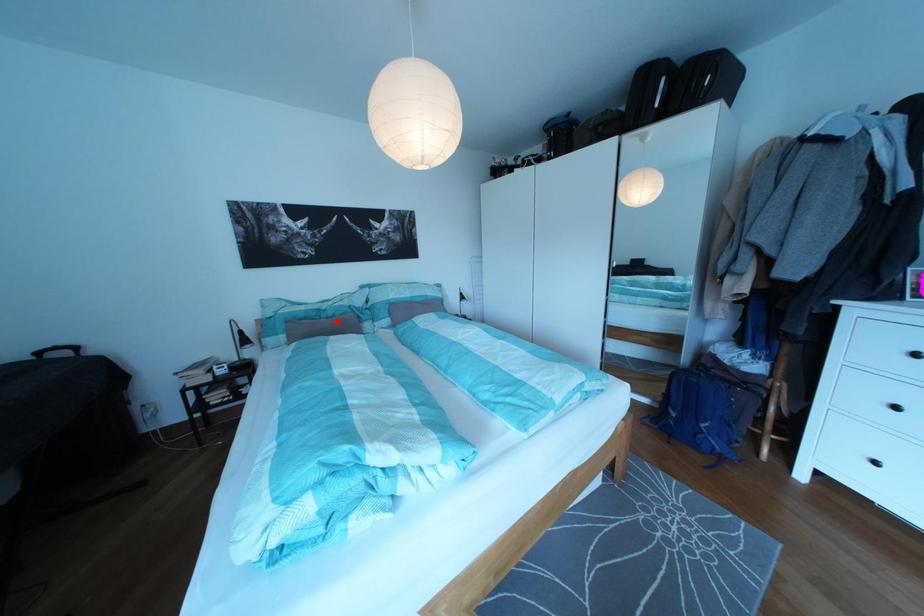
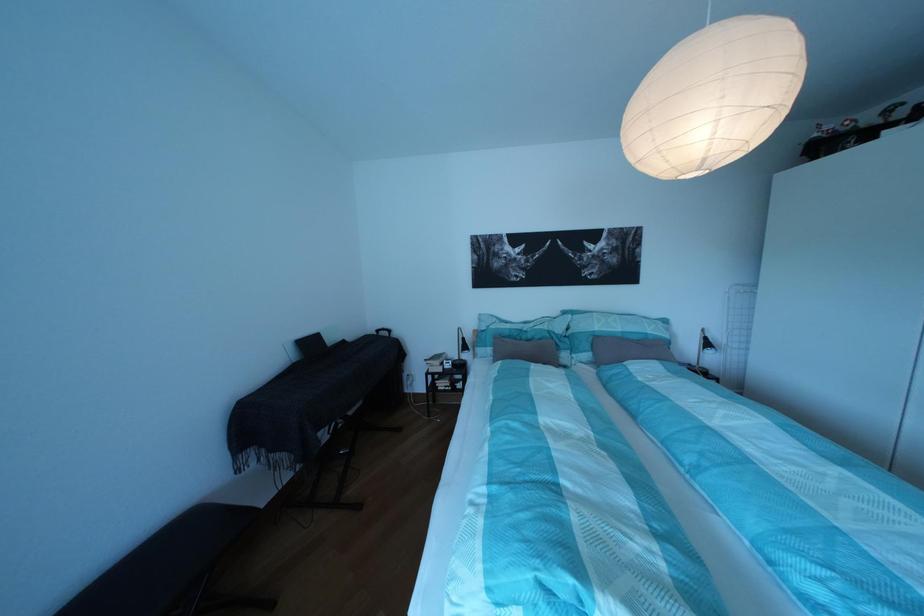
Question: A red point is marked in image1. In image2, is the corresponding 3D point closer to the camera or farther? Reply with the corresponding letter.

Choices:
 (A) The corresponding 3D point is closer.
 (B) The corresponding 3D point is farther.

Answer: (B)